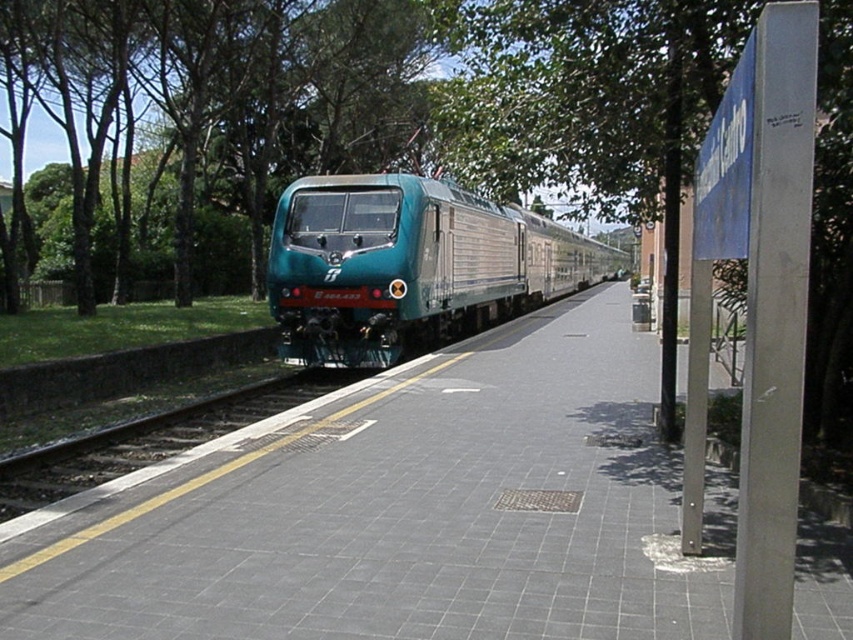
Question: Can you confirm if green leafy tree at upper center is bigger than smooth concrete track at center?

Choices:
 (A) yes
 (B) no

Answer: (A)

Question: Which point appears closest to the camera in this image?

Choices:
 (A) (726, 33)
 (B) (299, 388)
 (C) (300, 248)

Answer: (A)

Question: Which point is closer to the camera?

Choices:
 (A) green leafy tree at upper center
 (B) teal glossy train at center
 (C) smooth concrete track at center

Answer: (A)

Question: Which point is closer to the camera taking this photo?

Choices:
 (A) (112, 426)
 (B) (820, 72)
 (C) (495, 301)

Answer: (B)

Question: Does green leafy tree at upper center have a greater width compared to smooth concrete track at center?

Choices:
 (A) no
 (B) yes

Answer: (B)

Question: Can you confirm if teal glossy train at center is smaller than smooth concrete track at center?

Choices:
 (A) no
 (B) yes

Answer: (A)